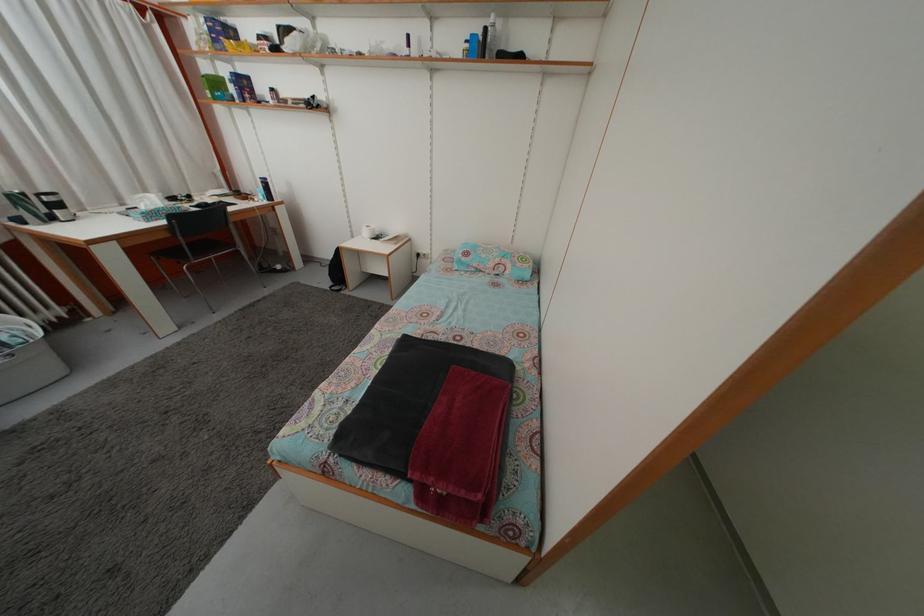
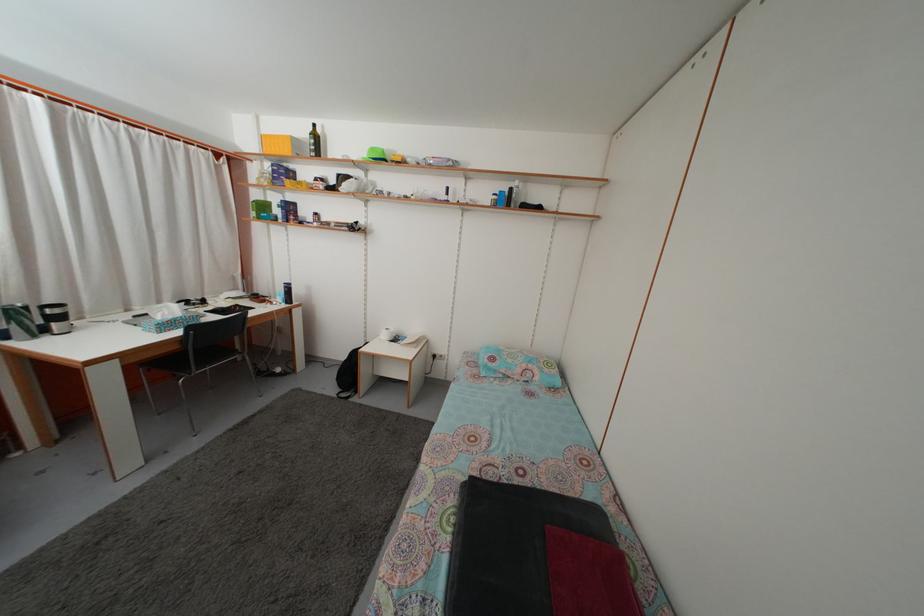
Question: Based on the continuous images, in which direction is the camera rotating? Reply with the corresponding letter.

Choices:
 (A) Left
 (B) Right
 (C) Up
 (D) Down

Answer: (C)